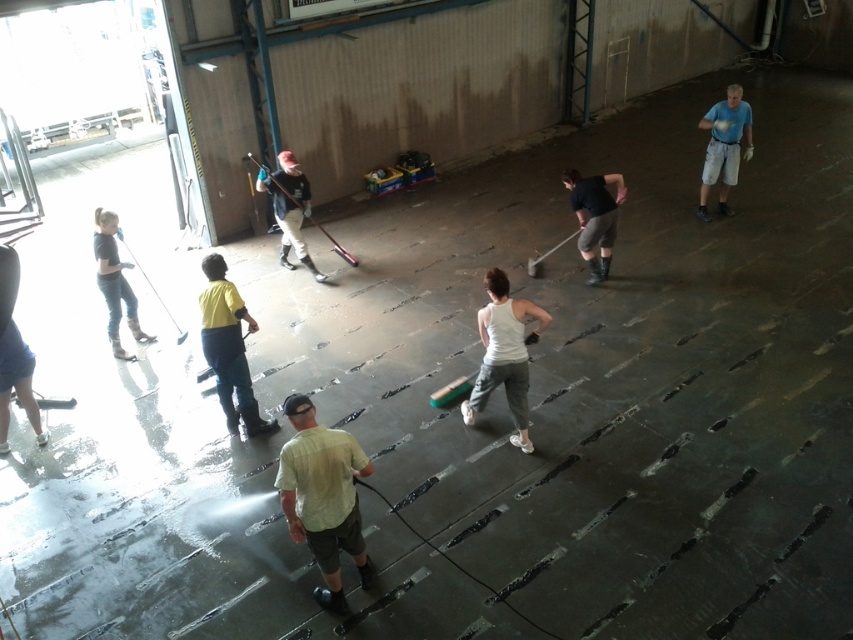
Question: Can you confirm if white matte tank top at center is positioned to the left of yellow fabric shirt at center?

Choices:
 (A) no
 (B) yes

Answer: (A)

Question: Is white matte tank top at center smaller than matte white baseball bat at center?

Choices:
 (A) no
 (B) yes

Answer: (B)

Question: Which point is closer to the camera?

Choices:
 (A) (749, 116)
 (B) (198, 300)
 (C) (111, 275)

Answer: (B)

Question: Which object is farther from the camera taking this photo?

Choices:
 (A) matte white baseball bat at center
 (B) blue t-shirt at upper right

Answer: (B)

Question: Which object is farther from the camera taking this photo?

Choices:
 (A) denim jeans at left
 (B) light green fabric shirt at center
 (C) black matte shorts at center
 (D) yellow fabric shirt at center

Answer: (C)

Question: Can you confirm if light green fabric shirt at center is positioned above yellow fabric shirt at center?

Choices:
 (A) yes
 (B) no

Answer: (B)